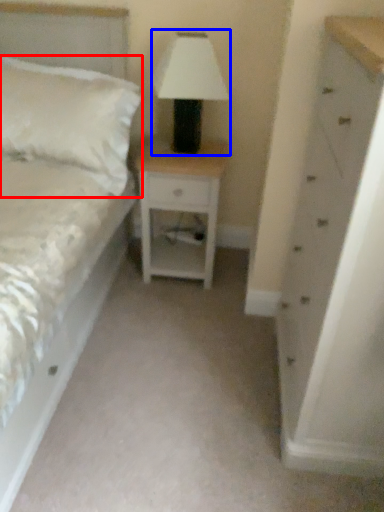
Question: Which object appears farthest to the camera in this image, pillow (highlighted by a red box) or table lamp (highlighted by a blue box)?

Choices:
 (A) pillow
 (B) table lamp

Answer: (A)